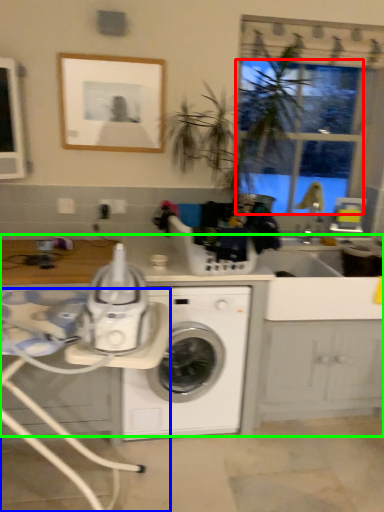
Question: Considering the real-world distances, which object is closest to window screen (highlighted by a red box)? table (highlighted by a blue box) or counter top (highlighted by a green box).

Choices:
 (A) table
 (B) counter top

Answer: (B)